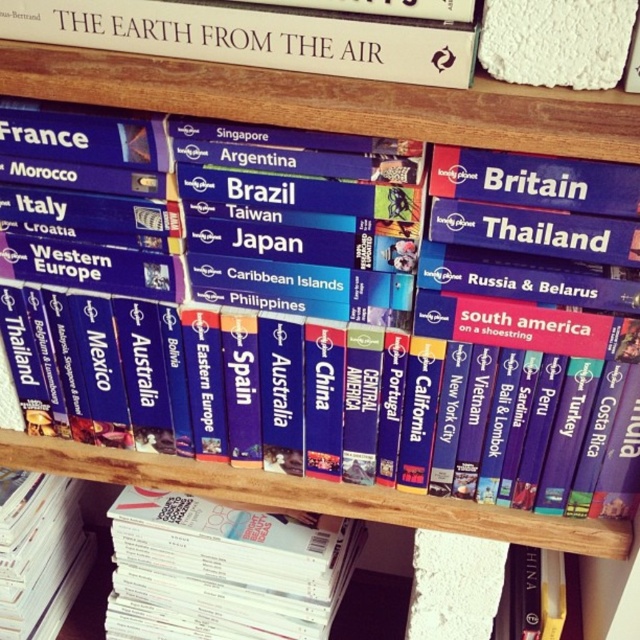
You are a librarian trying to organize books on a shelf. You have a white glossy book at lower center and a white paper book at lower left. The space between them is exactly 9.11 inches. If you need to place a new book that is 9 inches wide between them, will there be enough space?

The distance between the white glossy book at lower center and the white paper book at lower left is 9.11 inches. Since the new book is 9 inches wide, there is enough space to fit it between them with a little extra room.

Based on the photo, you are a librarian who needs to place a new book on the shelf. The new book is 20 inches thick. There is a space between the white paper book at upper center and the viewer. Can the new book fit in that space?

The space between the white paper book at upper center and the viewer is 20.57 inches, so the new book which is 20 inches thick can fit in that space since it is slightly smaller than the available space.